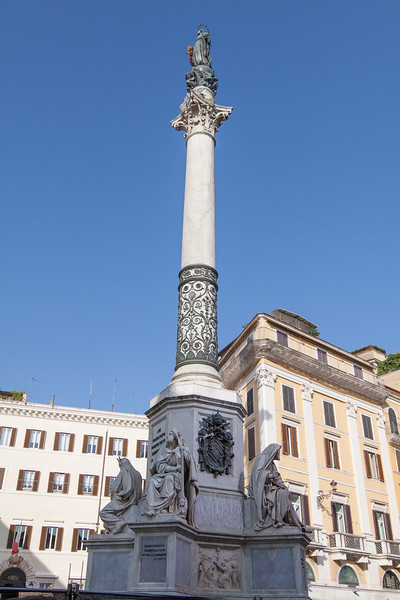
Where is `shuttered windows`? This screenshot has width=400, height=600. shuttered windows is located at coordinates (287, 438), (334, 452), (253, 443), (248, 403), (292, 401), (326, 411), (366, 424).